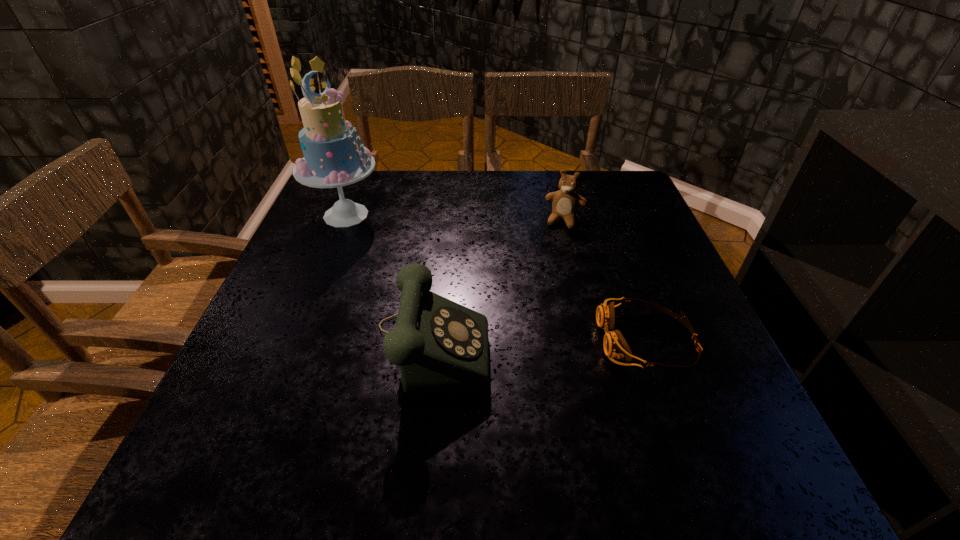
This screenshot has width=960, height=540. I want to click on blank space located on the front-facing side of the teddy bear, so click(x=537, y=316).

Locate an element on the screen. free point located on the front-facing side of the teddy bear is located at coordinates (544, 290).

The width and height of the screenshot is (960, 540). Identify the location of vacant space located on the front-facing side of the teddy bear. (556, 249).

Where is `vacant space situated with a ladder on the side of the leftmost object`? vacant space situated with a ladder on the side of the leftmost object is located at coordinates (403, 253).

I want to click on vacant space situated with a ladder on the side of the leftmost object, so tap(432, 272).

The width and height of the screenshot is (960, 540). Find the location of `free space located with a ladder on the side of the leftmost object`. free space located with a ladder on the side of the leftmost object is located at coordinates (441, 278).

At what (x,y) coordinates should I click in order to perform the action: click on teddy bear that is at the far edge. Please return your answer as a coordinate pair (x, y). Looking at the image, I should click on (565, 204).

In order to click on cake at the far edge in this screenshot , I will do `click(332, 159)`.

You are a GUI agent. You are given a task and a screenshot of the screen. Output one action in this format:
    pyautogui.click(x=<x>, y=<y>)
    Task: Click on the object that is at the near edge
    The image size is (960, 540).
    Given the screenshot: What is the action you would take?
    pyautogui.click(x=441, y=347)

What are the coordinates of `object that is at the left edge` in the screenshot? It's located at (332, 159).